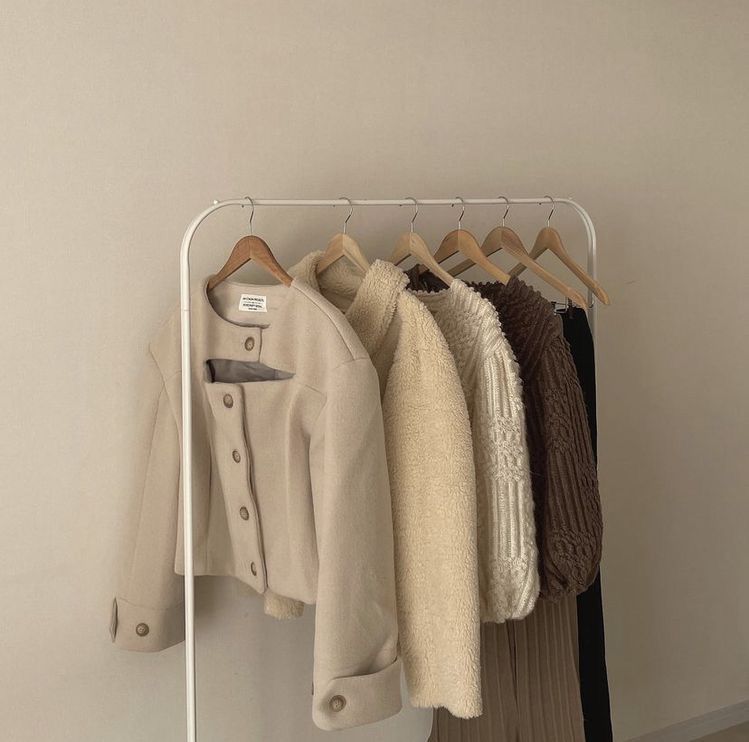
You are a GUI agent. You are given a task and a screenshot of the screen. Output one action in this format:
    pyautogui.click(x=<x>, y=<y>)
    Task: Click on the hangers
    
    Given the screenshot: What is the action you would take?
    pyautogui.click(x=255, y=266), pyautogui.click(x=342, y=246), pyautogui.click(x=425, y=255), pyautogui.click(x=455, y=246), pyautogui.click(x=512, y=243), pyautogui.click(x=542, y=240)